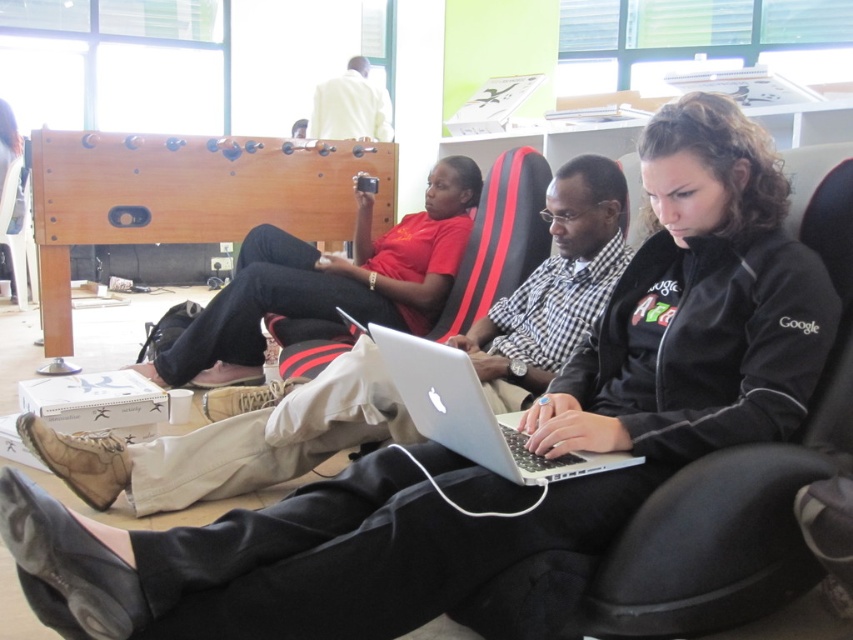
You are standing at the point marked as point (474,212) in the image. You want to take a photo of the three people seated on the gaming chairs. Considering your current position, will you be able to capture all three individuals in a single frame without moving? Explain your reasoning based on the distance provided.

The distance of point (474,212) from the camera is 9.56 feet. Since the three people are seated in a row on the gaming chairs, and you are positioned at a distance of 9.56 feet away from them, it is likely that all three can be captured in a single frame. The distance is sufficient to include the entire row of chairs within the camera frame, assuming the camera has a standard field of view.

You are planning to place a new decorative item on the black fabric chair at center. Considering the size of the chair, will the white matte shirt at upper center, which is currently on the chair, fit properly after placing the item?

The black fabric chair at center has a lesser width compared to white matte shirt at upper center, so placing the decorative item might cause the white matte shirt at upper center to not fit properly due to the reduced space.